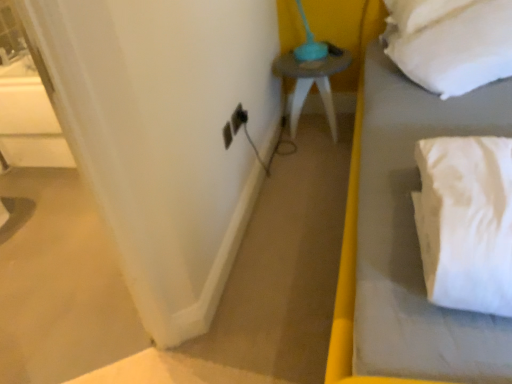
The image size is (512, 384). What are the coordinates of `unoccupied space behind white fabric curtain at left` in the screenshot? It's located at (97, 316).